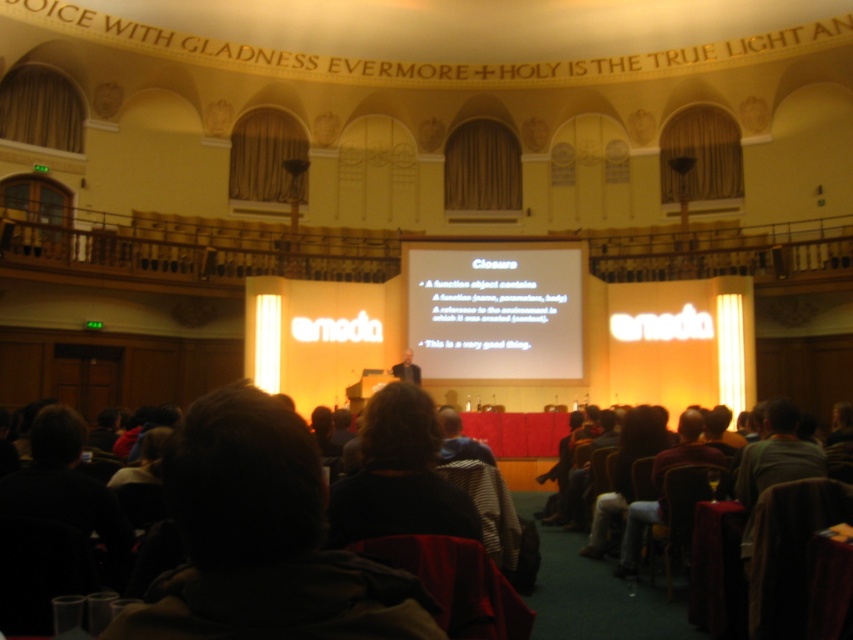
Question: Which point appears closest to the camera in this image?

Choices:
 (A) (549, 348)
 (B) (172, 573)
 (C) (401, 374)

Answer: (B)

Question: Estimate the real-world distances between objects in this image. Which object is farther from the matte black suit at center?

Choices:
 (A) dark brown hair at center
 (B) white matte projection screen at center

Answer: (A)

Question: Is white matte projection screen at center wider than matte black suit at center?

Choices:
 (A) yes
 (B) no

Answer: (A)

Question: Estimate the real-world distances between objects in this image. Which object is farther from the matte black suit at center?

Choices:
 (A) dark brown hair at center
 (B) white matte projection screen at center

Answer: (A)

Question: Is dark brown hair at center thinner than white matte projection screen at center?

Choices:
 (A) yes
 (B) no

Answer: (A)

Question: Does white matte projection screen at center have a larger size compared to matte black suit at center?

Choices:
 (A) no
 (B) yes

Answer: (B)